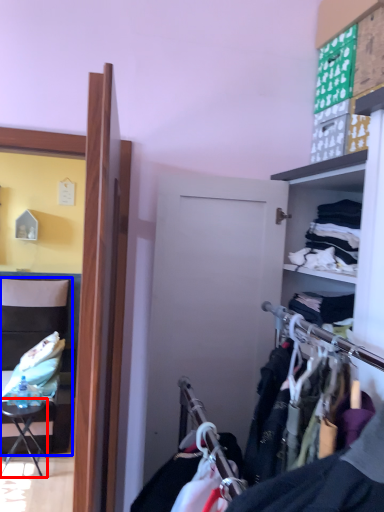
Question: Among these objects, which one is farthest to the camera, table (highlighted by a red box) or chair (highlighted by a blue box)?

Choices:
 (A) table
 (B) chair

Answer: (B)